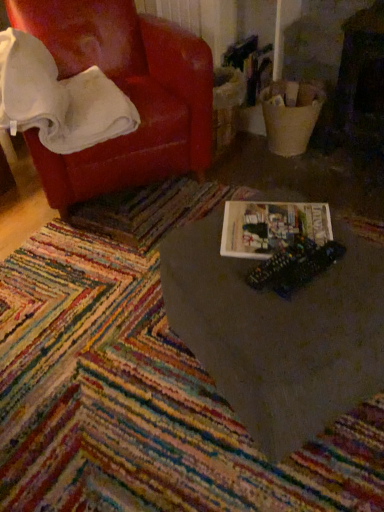
Identify the location of empty space that is ontop of white glossy book at center (from a real-world perspective). Image resolution: width=384 pixels, height=512 pixels. (289, 254).